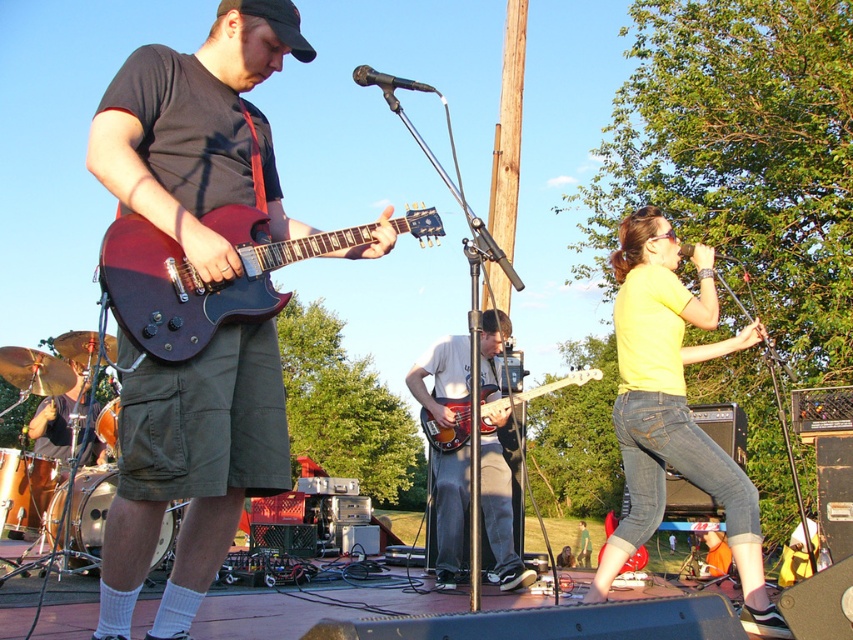
Which is above, matte black bass guitar at center or metallic silver microphone at upper right?

Positioned higher is metallic silver microphone at upper right.

Is matte black bass guitar at center taller than metallic silver microphone at upper right?

Correct, matte black bass guitar at center is much taller as metallic silver microphone at upper right.

Does point (503, 552) come in front of point (727, 253)?

That is True.

Where is `matte black bass guitar at center`? This screenshot has height=640, width=853. matte black bass guitar at center is located at coordinates (498, 508).

Which is in front, point (459, 429) or point (691, 244)?

Point (691, 244)

Describe the element at coordinates (447, 426) in the screenshot. I see `glossy wood bass at center` at that location.

Where is `glossy wood bass at center`? Image resolution: width=853 pixels, height=640 pixels. glossy wood bass at center is located at coordinates (447, 426).

Is the position of glossy wood guitar at left more distant than that of glossy wood bass at center?

No.

Does glossy wood guitar at left appear under glossy wood bass at center?

Actually, glossy wood guitar at left is above glossy wood bass at center.

Does point (138, 326) lie behind point (437, 444)?

No.

Find the location of a particular element. The height and width of the screenshot is (640, 853). glossy wood guitar at left is located at coordinates (199, 278).